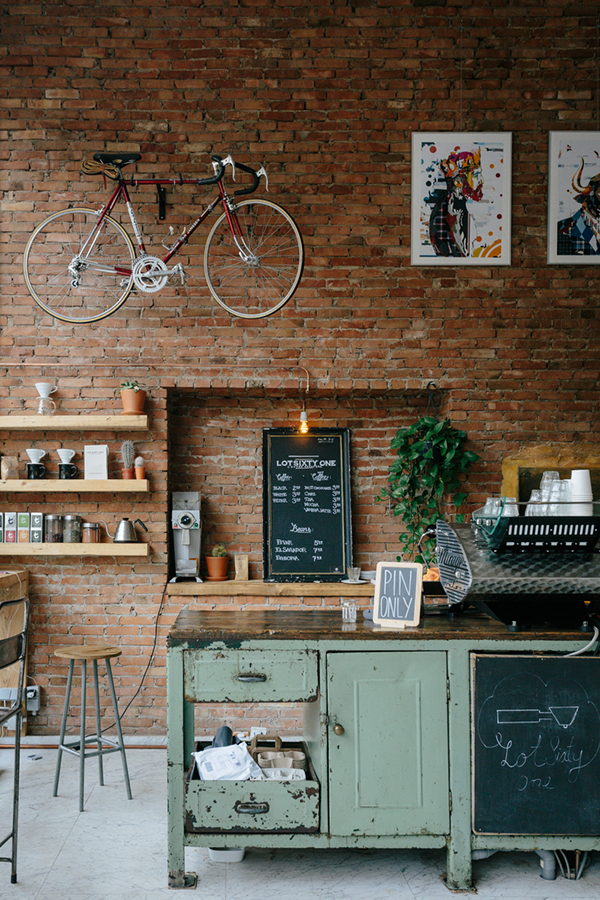
The image size is (600, 900). In order to click on houseplants in this screenshot , I will do `click(415, 481)`, `click(131, 385)`, `click(127, 453)`, `click(137, 464)`.